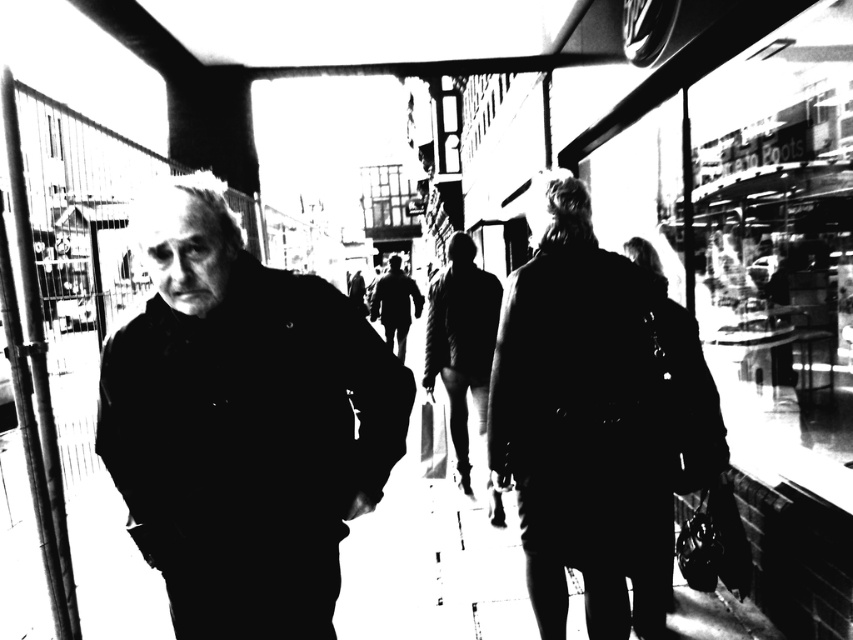
You are a fashion designer observing two coats displayed in a store window. The silky black coat at center and the dark textured coat at center are both in the same window. Which coat is taller?

The silky black coat at center is taller than the dark textured coat at center.

You are a fashion designer observing two coats in a photo. The silky black coat at center and the dark textured coat at center. Which coat is more likely to be made of a lightweight fabric?

The silky black coat at center is thinner than the dark textured coat at center, so it is more likely to be made of a lightweight fabric.

You are a photographer standing at the center of the street scene. You notice a silky black coat at center. Can you determine if the silky black coat at center is located exactly at the point with coordinates (x=595, y=417)?

Yes, the silky black coat at center is located exactly at the point with coordinates (x=595, y=417).